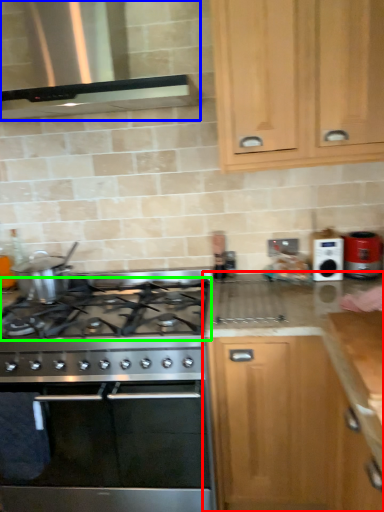
Question: Considering the real-world distances, which object is closest to cabinetry (highlighted by a red box)? vent (highlighted by a blue box) or gas stove (highlighted by a green box).

Choices:
 (A) vent
 (B) gas stove

Answer: (B)